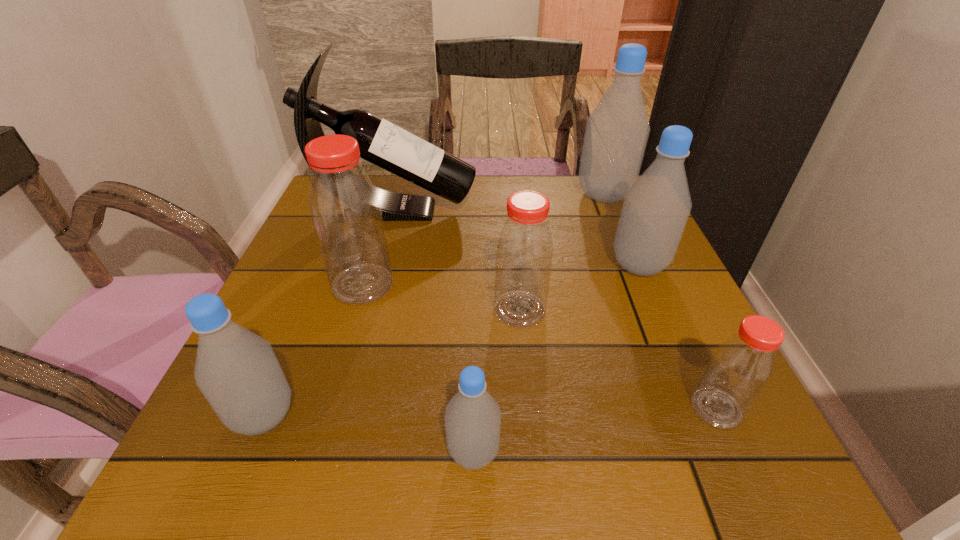
Identify the location of wine bottle. (382, 143).

The height and width of the screenshot is (540, 960). I want to click on the biggest gray bottle, so click(617, 130).

Identify the location of the farthest bottle. (617, 130).

At what (x,y) coordinates should I click in order to perform the action: click on the biggest red bottle. Please return your answer as a coordinate pair (x, y). This screenshot has width=960, height=540. Looking at the image, I should click on (345, 210).

Identify the location of the second biggest gray bottle. (656, 208).

Locate an element on the screen. The width and height of the screenshot is (960, 540). the second red bottle from right to left is located at coordinates (524, 251).

Where is `the third biggest gray bottle`? The width and height of the screenshot is (960, 540). the third biggest gray bottle is located at coordinates (237, 371).

Locate an element on the screen. The image size is (960, 540). the nearest red bottle is located at coordinates (741, 367).

Identify the location of the rightmost red bottle. (741, 367).

Identify the location of the smallest gray bottle. (472, 418).